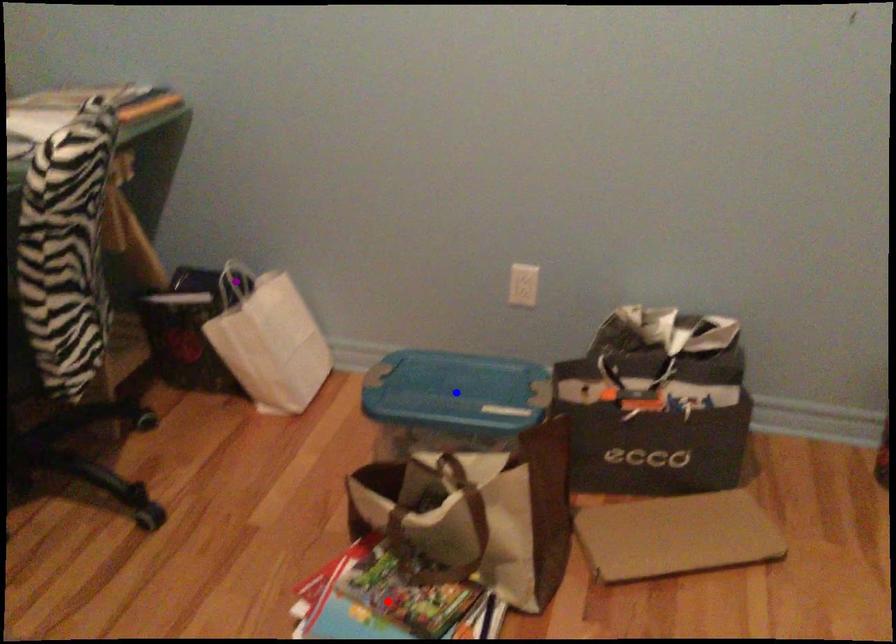
Order these from nearest to farthest:
1. purple point
2. red point
3. blue point

red point, blue point, purple point